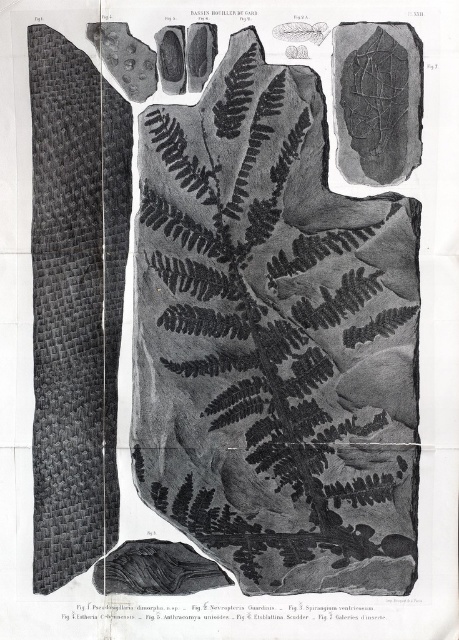
You are a paleontologist examining this fossil illustration. You need to determine the spatial relationship between the black textured fern at center and the smooth gray rock at upper right. Based on the illustration, which object is positioned further away from the viewer?

The smooth gray rock at upper right is positioned further away from the viewer than the black textured fern at center because it is placed behind the fern in the illustration.

You are a researcher holding a camera 4.30 feet away from the black textured fern at center. You need to take a photo of the fern. Is the distance sufficient to capture the entire fern in the frame?

The black textured fern at center and camera are 4.30 feet apart from each other. Whether the distance is sufficient depends on the camera lens and sensor size, but the question does not provide this information. Therefore, it cannot be determined if the distance is sufficient to capture the entire fern in the frame.

You are an archaeologist examining the fossilized fern in the center of the illustration. You notice two points labeled in the image, point (x=345, y=518) and point (x=370, y=157). Based on their positions, which point is closer to the front of the illustration?

Point (x=370, y=157) is closer to the front of the illustration because it is in front of point (x=345, y=518).